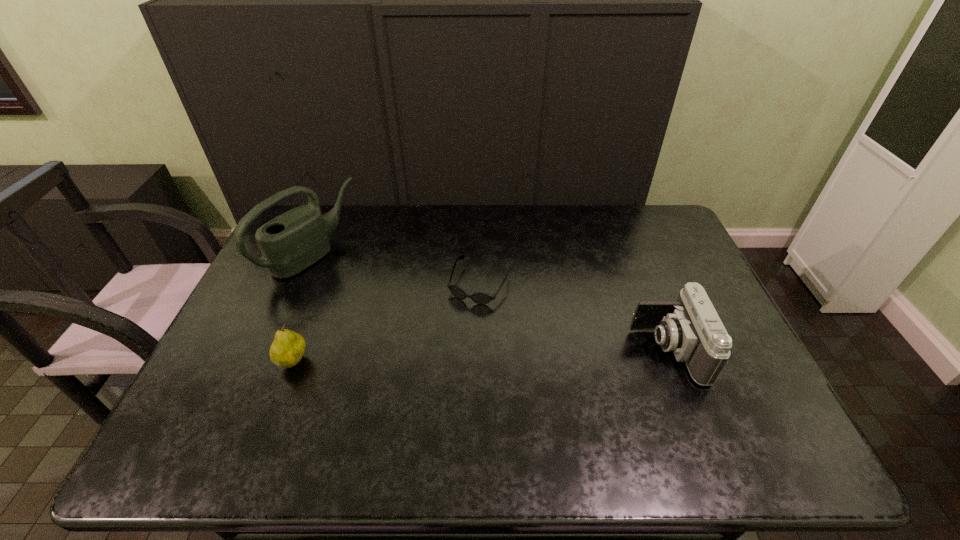
At what (x,y) coordinates should I click in order to perform the action: click on vacant point located between the third tallest object and the camera. Please return your answer as a coordinate pair (x, y). Looking at the image, I should click on (480, 356).

You are a GUI agent. You are given a task and a screenshot of the screen. Output one action in this format:
    pyautogui.click(x=<x>, y=<y>)
    Task: Click on the vacant area between the camera and the third tallest object
    The height and width of the screenshot is (540, 960).
    Given the screenshot: What is the action you would take?
    pyautogui.click(x=480, y=356)

Select which object is the third closest to the second object from right to left. Please provide its 2D coordinates. Your answer should be formatted as a tuple, i.e. [(x, y)], where the tuple contains the x and y coordinates of a point satisfying the conditions above.

[(287, 349)]

Choose which object is the second nearest neighbor to the pear. Please provide its 2D coordinates. Your answer should be formatted as a tuple, i.e. [(x, y)], where the tuple contains the x and y coordinates of a point satisfying the conditions above.

[(481, 298)]

Where is `free point that satisfies the following two spatial constraints: 1. on the back side of the shortest object; 2. on the left side of the second shortest object`? Image resolution: width=960 pixels, height=540 pixels. free point that satisfies the following two spatial constraints: 1. on the back side of the shortest object; 2. on the left side of the second shortest object is located at coordinates (323, 284).

Where is `free space that satisfies the following two spatial constraints: 1. on the back side of the pear; 2. at the front of the camera with an open lens cover`? The width and height of the screenshot is (960, 540). free space that satisfies the following two spatial constraints: 1. on the back side of the pear; 2. at the front of the camera with an open lens cover is located at coordinates (298, 350).

Locate an element on the screen. vacant region that satisfies the following two spatial constraints: 1. on the front side of the camera; 2. at the front of the third object from left to right with an open lens cover is located at coordinates (479, 350).

In order to click on free space that satisfies the following two spatial constraints: 1. on the front side of the pear; 2. on the right side of the tallest object in this screenshot , I will do `click(265, 362)`.

Locate an element on the screen. This screenshot has width=960, height=540. vacant region that satisfies the following two spatial constraints: 1. on the front side of the camera; 2. at the front of the tallest object with an open lens cover is located at coordinates (270, 350).

The width and height of the screenshot is (960, 540). In order to click on vacant area that satisfies the following two spatial constraints: 1. on the front side of the sunglasses; 2. at the front of the rightmost object with an open lens cover in this screenshot , I will do `click(479, 350)`.